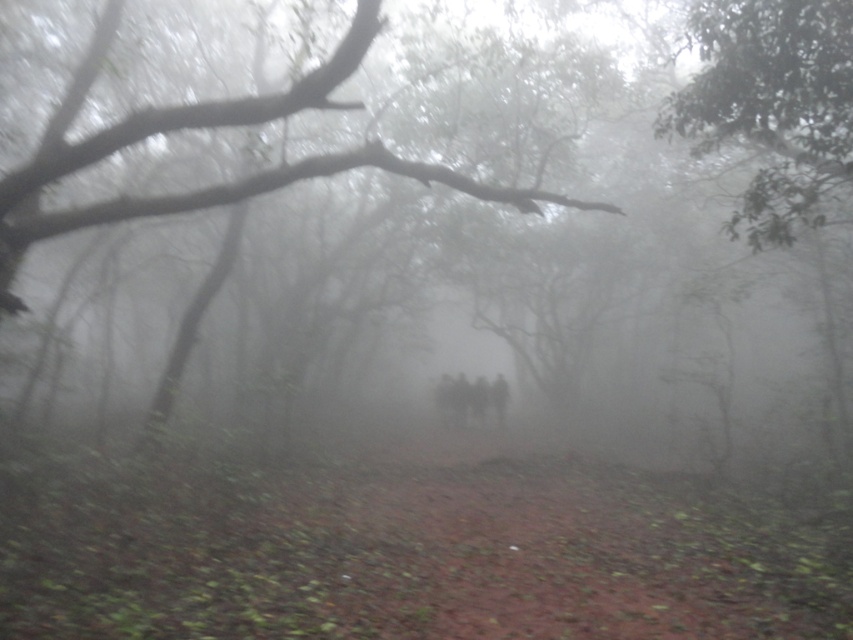
Which is behind, point (223, 531) or point (99, 65)?

The point (99, 65) is more distant.

Locate an element on the screen. brown dirt path at center is located at coordinates (407, 554).

At what (x,y) coordinates should I click in order to perform the action: click on brown dirt path at center. Please return your answer as a coordinate pair (x, y). The width and height of the screenshot is (853, 640). Looking at the image, I should click on (407, 554).

Find the location of `brown dirt path at center`. brown dirt path at center is located at coordinates (407, 554).

Between point (785, 76) and point (242, 186), which one is positioned behind?

The point (785, 76) is more distant.

Does green leafy tree at upper right have a lesser height compared to smooth bark tree at center?

Yes.

Who is more forward, (772,92) or (335,67)?

Point (335,67)

Locate an element on the screen. This screenshot has width=853, height=640. green leafy tree at upper right is located at coordinates (770, 104).

Which is in front, point (762, 616) or point (764, 33)?

Positioned in front is point (762, 616).

Measure the distance between point [691,493] and camera.

The distance of point [691,493] from camera is 39.41 feet.

The height and width of the screenshot is (640, 853). What are the coordinates of `brown dirt path at center` in the screenshot? It's located at (407, 554).